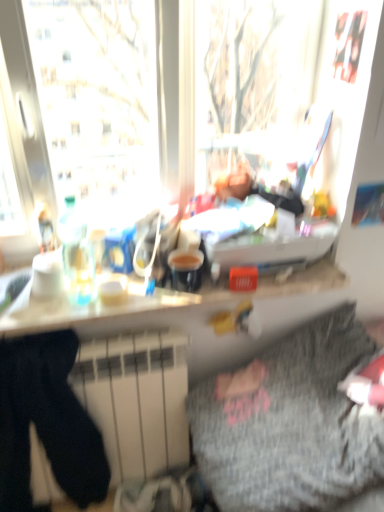
What do you see at coordinates (136, 400) in the screenshot? The image size is (384, 512). I see `white matte radiator at lower left` at bounding box center [136, 400].

What do you see at coordinates (158, 305) in the screenshot? Image resolution: width=384 pixels, height=512 pixels. I see `white glossy counter top at center` at bounding box center [158, 305].

The image size is (384, 512). Find the location of `gray textured blanket at lower right`. gray textured blanket at lower right is located at coordinates (289, 423).

Describe the element at coordinates (289, 423) in the screenshot. I see `gray textured blanket at lower right` at that location.

Identify the location of black cotton sweat pants at lower left. This screenshot has width=384, height=512. (46, 422).

Image resolution: width=384 pixels, height=512 pixels. I want to click on white matte radiator at lower left, so click(x=136, y=400).

Is black cotton sweat pants at lower left at the back of white matte radiator at lower left?

Yes.

What's the angular difference between white matte radiator at lower left and black cotton sweat pants at lower left's facing directions?

white matte radiator at lower left and black cotton sweat pants at lower left are facing 2.02e-05 degrees away from each other.

Is point (121, 346) more distant than point (68, 489)?

No, it is not.

From the image's perspective, who appears lower, white matte radiator at lower left or black cotton sweat pants at lower left?

black cotton sweat pants at lower left appears lower in the image.

From the image's perspective, is white glossy counter top at center positioned above or below gray textured blanket at lower right?

white glossy counter top at center is above gray textured blanket at lower right.

Which is less distant, (142, 291) or (228, 451)?

Clearly, point (142, 291) is more distant from the camera than point (228, 451).

Which object is thinner, white glossy counter top at center or gray textured blanket at lower right?

white glossy counter top at center.

In the image, is gray textured blanket at lower right on the left side or the right side of white glossy counter top at center?

gray textured blanket at lower right is positioned on white glossy counter top at center's right side.

Could you tell me if gray textured blanket at lower right is turned towards white glossy counter top at center?

No, gray textured blanket at lower right is not facing towards white glossy counter top at center.

Is gray textured blanket at lower right not inside white glossy counter top at center?

Yes, gray textured blanket at lower right is located beyond the bounds of white glossy counter top at center.

Which object is further away from the camera taking this photo, gray textured blanket at lower right or white glossy counter top at center?

white glossy counter top at center is further from the camera.

Considering the sizes of objects white matte radiator at lower left and gray textured blanket at lower right in the image provided, who is thinner, white matte radiator at lower left or gray textured blanket at lower right?

With smaller width is white matte radiator at lower left.

Which object is more forward, white matte radiator at lower left or gray textured blanket at lower right?

gray textured blanket at lower right is closer to the camera.

Does white matte radiator at lower left have a larger size compared to gray textured blanket at lower right?

No.

Is white matte radiator at lower left situated inside gray textured blanket at lower right or outside?

The correct answer is: outside.

Is white glossy counter top at center positioned before white matte radiator at lower left?

No, white glossy counter top at center is further to the viewer.

Is white glossy counter top at center smaller than white matte radiator at lower left?

Indeed, white glossy counter top at center has a smaller size compared to white matte radiator at lower left.

Is white glossy counter top at center aimed at white matte radiator at lower left?

No, white glossy counter top at center does not turn towards white matte radiator at lower left.

Find the location of a particular element. The height and width of the screenshot is (512, 384). counter top on the right of white matte radiator at lower left is located at coordinates (158, 305).

Does gray textured blanket at lower right contain black cotton sweat pants at lower left?

No, black cotton sweat pants at lower left is located outside of gray textured blanket at lower right.

Considering the positions of points (303, 385) and (28, 386), is point (303, 385) farther from camera compared to point (28, 386)?

Yes, it is behind point (28, 386).

Is black cotton sweat pants at lower left at the back of gray textured blanket at lower right?

No, gray textured blanket at lower right's orientation is not away from black cotton sweat pants at lower left.

At what (x,y) coordinates should I click in order to perform the action: click on sweat pant located behind the gray textured blanket at lower right. Please return your answer as a coordinate pair (x, y). Looking at the image, I should click on (46, 422).

Looking at the image, does black cotton sweat pants at lower left seem bigger or smaller compared to gray textured blanket at lower right?

black cotton sweat pants at lower left is smaller than gray textured blanket at lower right.

At what (x,y) coordinates should I click in order to perform the action: click on sweat pant behind the gray textured blanket at lower right. Please return your answer as a coordinate pair (x, y). Looking at the image, I should click on (46, 422).

In the image, is black cotton sweat pants at lower left positioned in front of or behind gray textured blanket at lower right?

Clearly, black cotton sweat pants at lower left is behind gray textured blanket at lower right.

This screenshot has width=384, height=512. What are the coordinates of `radiator behind the black cotton sweat pants at lower left` in the screenshot? It's located at (136, 400).

This screenshot has width=384, height=512. I want to click on counter top on the left of gray textured blanket at lower right, so click(158, 305).

Considering their positions, is gray textured blanket at lower right positioned closer to white matte radiator at lower left than black cotton sweat pants at lower left?

black cotton sweat pants at lower left lies closer to white matte radiator at lower left than the other object.

When comparing their distances from black cotton sweat pants at lower left, does gray textured blanket at lower right or white glossy counter top at center seem further?

gray textured blanket at lower right is positioned further to the anchor black cotton sweat pants at lower left.

Looking at the image, which one is located closer to gray textured blanket at lower right, black cotton sweat pants at lower left or white matte radiator at lower left?

Based on the image, white matte radiator at lower left appears to be nearer to gray textured blanket at lower right.

Estimate the real-world distances between objects in this image. Which object is closer to white matte radiator at lower left, white glossy counter top at center or black cotton sweat pants at lower left?

black cotton sweat pants at lower left.

From the image, which object appears to be farther from gray textured blanket at lower right, white matte radiator at lower left or black cotton sweat pants at lower left?

black cotton sweat pants at lower left.

When comparing their distances from white glossy counter top at center, does black cotton sweat pants at lower left or white matte radiator at lower left seem closer?

Based on the image, white matte radiator at lower left appears to be nearer to white glossy counter top at center.

Estimate the real-world distances between objects in this image. Which object is further from gray textured blanket at lower right, black cotton sweat pants at lower left or white glossy counter top at center?

Among the two, black cotton sweat pants at lower left is located further to gray textured blanket at lower right.

Based on their spatial positions, is gray textured blanket at lower right or black cotton sweat pants at lower left closer to white glossy counter top at center?

black cotton sweat pants at lower left is positioned closer to the anchor white glossy counter top at center.

Locate an element on the screen. counter top situated between black cotton sweat pants at lower left and gray textured blanket at lower right from left to right is located at coordinates (158, 305).

The image size is (384, 512). What are the coordinates of `radiator between white glossy counter top at center and black cotton sweat pants at lower left in the vertical direction` in the screenshot? It's located at tap(136, 400).

I want to click on counter top between white matte radiator at lower left and gray textured blanket at lower right from left to right, so click(x=158, y=305).

The image size is (384, 512). Find the location of `radiator located between black cotton sweat pants at lower left and gray textured blanket at lower right in the left-right direction`. radiator located between black cotton sweat pants at lower left and gray textured blanket at lower right in the left-right direction is located at coordinates (136, 400).